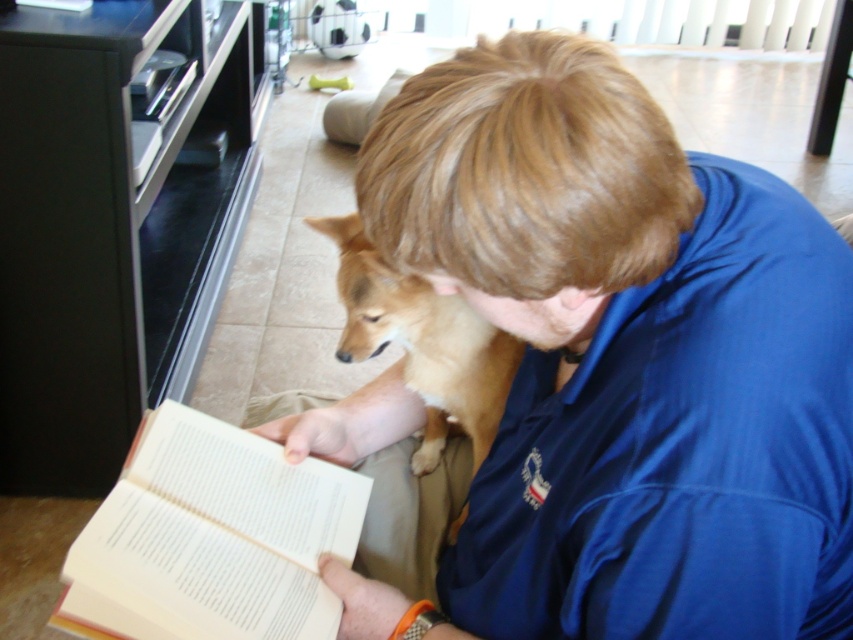
Is point (628, 189) positioned in front of point (202, 550)?

Yes, it is.

Which of these two, blue fabric shirt at center or white paper book at lower left, stands shorter?

white paper book at lower left is shorter.

Between point (643, 125) and point (334, 538), which one is positioned behind?

The point (334, 538) is behind.

Identify the location of blue fabric shirt at center. (601, 369).

Is the position of blue fabric shirt at center more distant than that of light brown fur at center?

No, blue fabric shirt at center is closer to the viewer.

Who is more distant from viewer, (645, 404) or (386, 324)?

The point (386, 324) is more distant.

Which is in front, point (444, 515) or point (384, 305)?

Point (444, 515) is in front.

Where is `blue fabric shirt at center`? The width and height of the screenshot is (853, 640). blue fabric shirt at center is located at coordinates (601, 369).

Is white paper book at lower left above light brown fur at center?

Actually, white paper book at lower left is below light brown fur at center.

Is white paper book at lower left positioned at the back of light brown fur at center?

That is False.

Which is behind, point (85, 540) or point (367, 355)?

Point (367, 355)

In order to click on white paper book at lower left in this screenshot , I will do `click(215, 536)`.